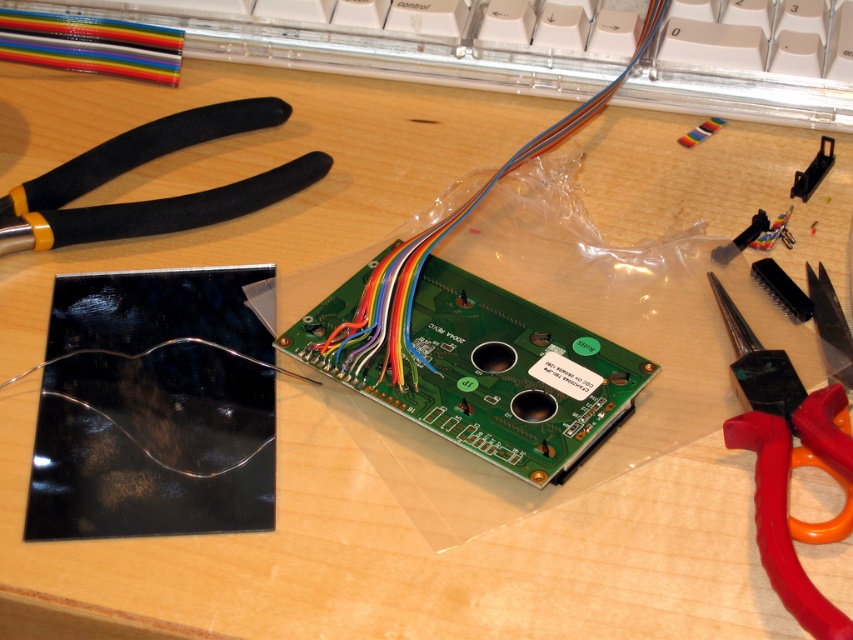
Does red plastic scissors at lower right appear over black plastic bracket at upper right?

No, red plastic scissors at lower right is not above black plastic bracket at upper right.

Which is in front, point (718, 294) or point (827, 150)?

Point (718, 294) is in front.

Where is `red plastic scissors at lower right`? The width and height of the screenshot is (853, 640). red plastic scissors at lower right is located at coordinates (781, 465).

Is point (369, 296) farther from viewer compared to point (813, 188)?

No.

Does rainbow cable at center have a lesser height compared to black plastic bracket at upper right?

In fact, rainbow cable at center may be taller than black plastic bracket at upper right.

Between point (639, 45) and point (799, 176), which one is positioned behind?

The point (639, 45) is more distant.

Locate an element on the screen. rainbow cable at center is located at coordinates (428, 253).

Does black rubberized scissors at upper left appear on the right side of black plastic bracket at upper right?

Incorrect, black rubberized scissors at upper left is not on the right side of black plastic bracket at upper right.

What are the coordinates of `black rubberized scissors at upper left` in the screenshot? It's located at (155, 198).

This screenshot has width=853, height=640. What are the coordinates of `black rubberized scissors at upper left` in the screenshot? It's located at (155, 198).